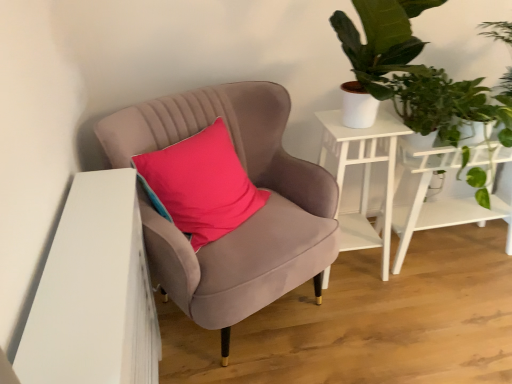
Locate an element on the screen. vacant region to the right of velvet pink chair at center is located at coordinates (410, 328).